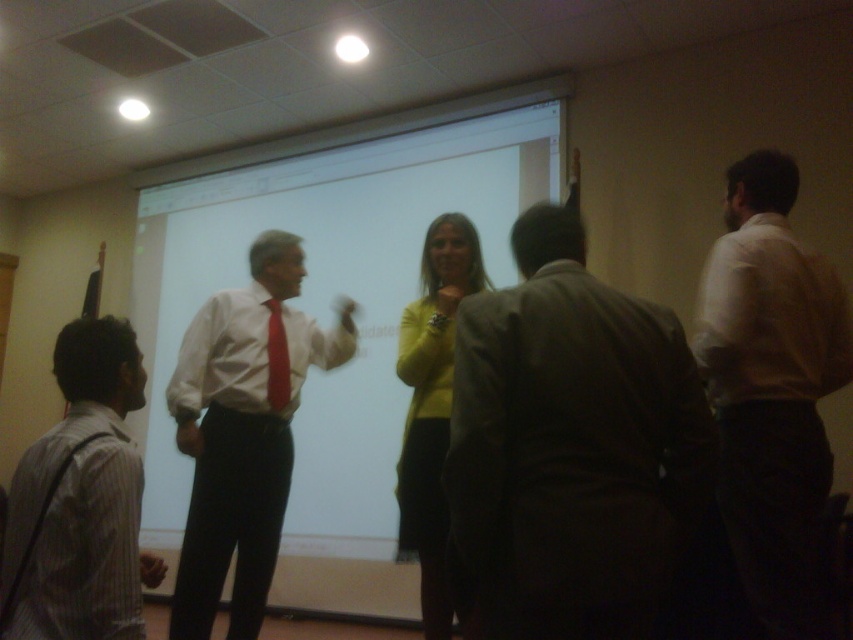
Question: Among these points, which one is farthest from the camera?

Choices:
 (A) (413, 168)
 (B) (193, 497)
 (C) (67, 600)

Answer: (A)

Question: Does white smooth shirt at right come behind white glossy shirt at center?

Choices:
 (A) yes
 (B) no

Answer: (B)

Question: Can you confirm if white smooth shirt at right is positioned above matte red tie at left?

Choices:
 (A) no
 (B) yes

Answer: (A)

Question: Does yellow sweater at center appear on the right side of matte red tie at left?

Choices:
 (A) yes
 (B) no

Answer: (A)

Question: Which point is closer to the camera taking this photo?

Choices:
 (A) (178, 381)
 (B) (670, 458)

Answer: (B)

Question: Which of the following is the closest to the observer?

Choices:
 (A) (271, 333)
 (B) (410, 476)
 (C) (71, 435)
 (D) (537, 246)

Answer: (D)